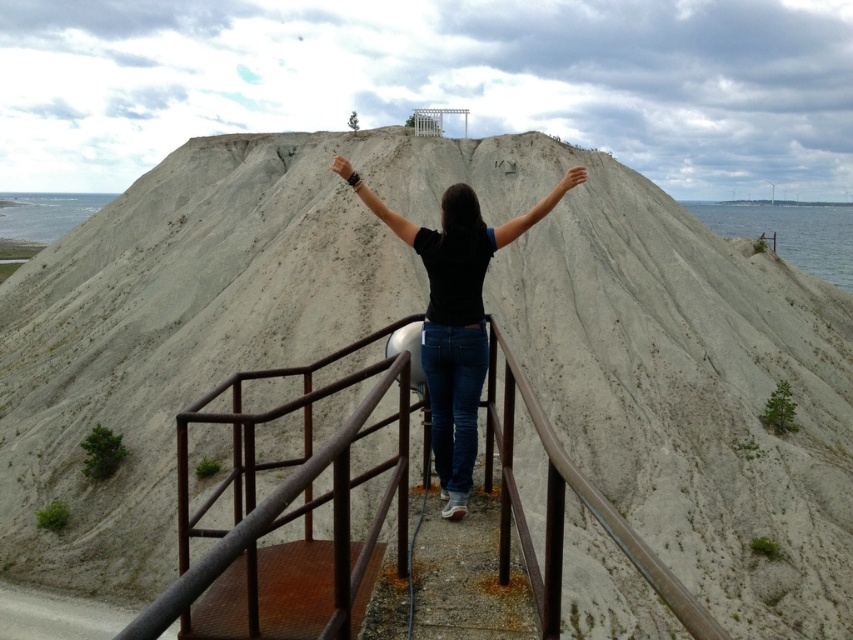
Question: Among these objects, which one is nearest to the camera?

Choices:
 (A) black matte arm at center
 (B) black matte arm at upper center

Answer: (A)

Question: Is black matte shirt at center bigger than matte black hand at upper center?

Choices:
 (A) yes
 (B) no

Answer: (B)

Question: Is rusty metal railing at center positioned at the back of black matte arm at center?

Choices:
 (A) yes
 (B) no

Answer: (B)

Question: Is rusty metal railing at center wider than blue water at lower right?

Choices:
 (A) yes
 (B) no

Answer: (B)

Question: Among these points, which one is farthest from the camera?

Choices:
 (A) (35, 225)
 (B) (520, 218)
 (C) (271, 563)
 (D) (343, 172)

Answer: (A)

Question: Which object appears closest to the camera in this image?

Choices:
 (A) black matte arm at upper center
 (B) blue water at lower right
 (C) rusty metal railing at center
 (D) black matte arm at center

Answer: (C)